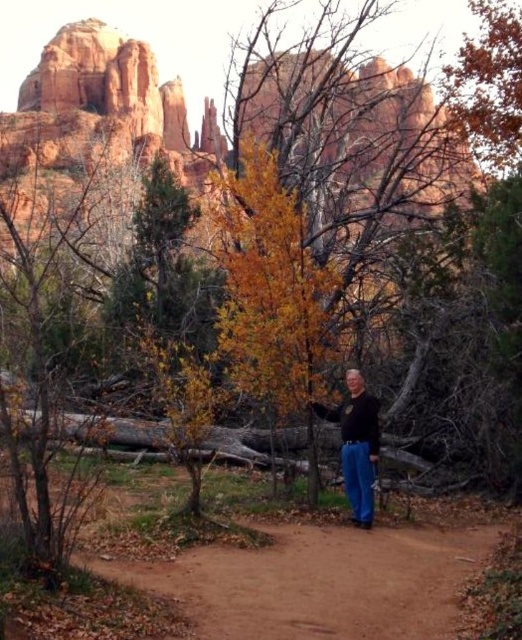
You are a hiker carrying a backpack with a width of 0.5 meters. You want to walk along the brown dirt path at center while avoiding the black matte shirt at center. Is the path wide enough for you to pass safely?

The brown dirt path at center might be wider than black matte shirt at center, so it is possible that the path is wide enough for the hiker to pass safely. However, since the exact width isn not specified, there is some uncertainty.

You are a hiker who wants to walk along the brown dirt path at center without stepping on the black matte shirt at center. Is this possible based on the scene?

The brown dirt path at center is positioned under the black matte shirt at center, so the shirt is likely covering the path. Therefore, it might not be possible to walk along the path without stepping on the shirt.

You are a hiker trying to follow the brown dirt path at center while avoiding the black matte shirt at center. Since both are in your line of sight, which one should you focus on first to stay on the correct path?

The brown dirt path at center is closer to the viewer than the black matte shirt at center, so you should focus on the brown dirt path at center first to stay on the correct path.